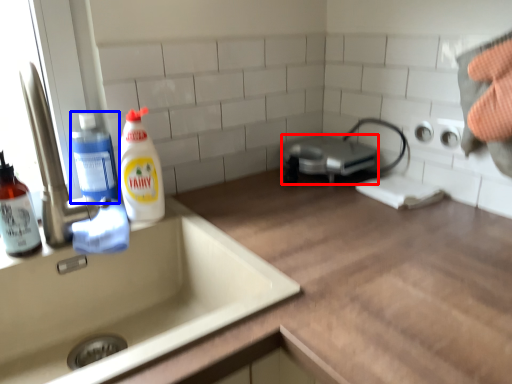
Question: Which of the following is the closest to the observer, appliance (highlighted by a red box) or cleaning product (highlighted by a blue box)?

Choices:
 (A) appliance
 (B) cleaning product

Answer: (B)